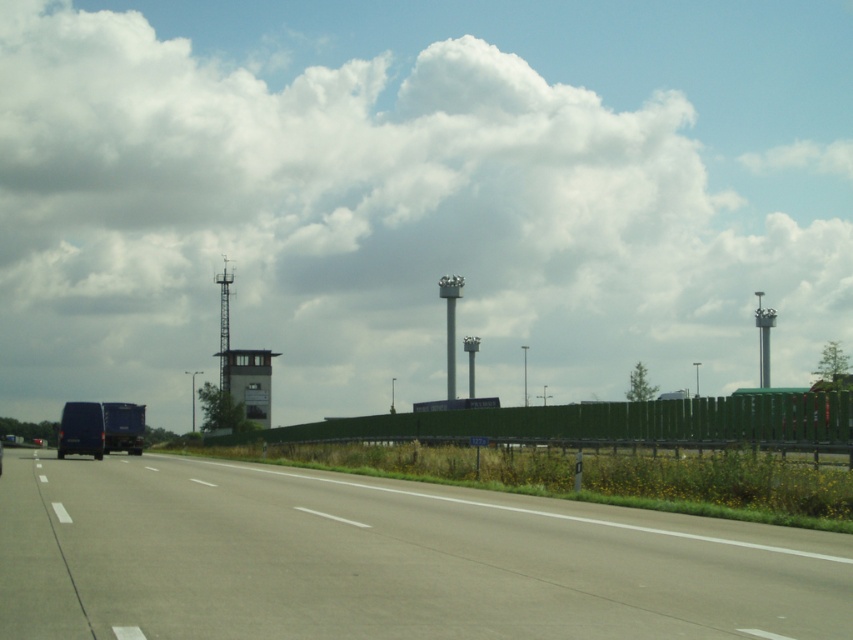
You are driving a car and see the white fluffy cloud at upper center in the distance. Your GPS says you need to stop your car before reaching the cloud. Can you safely stop your car in time if you are currently 200 meters away from the cloud?

The white fluffy cloud at upper center is 183.14 meters away from the camera. Since you are currently 200 meters away from the cloud, you are still 16.86 meters behind the cloud. Therefore, you can safely stop your car before reaching the cloud.

You are driving a car and see the white fluffy cloud at upper center and the gray asphalt highway at center. Which object is located above the other?

The white fluffy cloud at upper center is positioned over the gray asphalt highway at center.